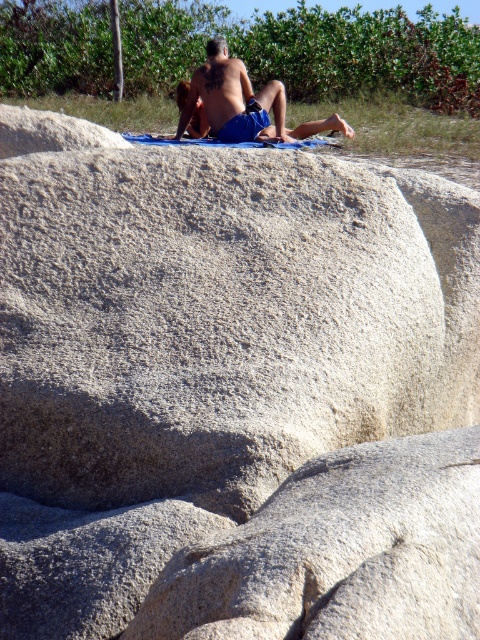
Who is positioned more to the left, gray rough rock at center or smooth skin tattooed man at upper center?

Positioned to the left is smooth skin tattooed man at upper center.

Between gray rough rock at center and smooth skin tattooed man at upper center, which one is positioned higher?

smooth skin tattooed man at upper center is higher up.

What do you see at coordinates (339, 552) in the screenshot?
I see `gray rough rock at center` at bounding box center [339, 552].

Find the location of a particular element. The height and width of the screenshot is (640, 480). gray rough rock at center is located at coordinates (339, 552).